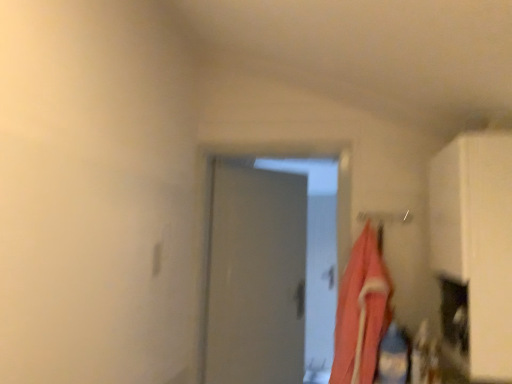
Measure the distance between matte pink fabric at right and camera.

They are 2.06 meters apart.

Identify the location of matte pink fabric at right. This screenshot has width=512, height=384. 361,312.

Measure the distance between point (374, 341) and camera.

Point (374, 341) is 2.08 meters from camera.

Describe the element at coordinates (361, 312) in the screenshot. The image size is (512, 384). I see `matte pink fabric at right` at that location.

What are the coordinates of `white matte cabinet at right` in the screenshot? It's located at (477, 241).

The height and width of the screenshot is (384, 512). What do you see at coordinates (477, 241) in the screenshot?
I see `white matte cabinet at right` at bounding box center [477, 241].

What is the approximate height of white matte cabinet at right?

white matte cabinet at right is 37.44 inches in height.

The height and width of the screenshot is (384, 512). In order to click on matte pink fabric at right in this screenshot , I will do (x=361, y=312).

Based on their positions, is matte pink fabric at right located to the left or right of white matte cabinet at right?

In the image, matte pink fabric at right appears on the left side of white matte cabinet at right.

Which is in front, matte pink fabric at right or white matte cabinet at right?

Positioned in front is white matte cabinet at right.

From the picture: Which is less distant, (386, 287) or (467, 202)?

The point (467, 202) is more forward.

In the scene shown: From the image's perspective, is matte pink fabric at right above or below white matte cabinet at right?

Based on their image positions, matte pink fabric at right is located beneath white matte cabinet at right.

From a real-world perspective, is matte pink fabric at right positioned above or below white matte cabinet at right?

Answer: Clearly, from a real-world perspective, matte pink fabric at right is below white matte cabinet at right.

Considering the relative sizes of matte pink fabric at right and white matte cabinet at right in the image provided, is matte pink fabric at right wider than white matte cabinet at right?

No.

Who is shorter, matte pink fabric at right or white matte cabinet at right?

Standing shorter between the two is matte pink fabric at right.

Who is bigger, matte pink fabric at right or white matte cabinet at right?

white matte cabinet at right.

Is matte pink fabric at right completely or partially outside of white matte cabinet at right?

matte pink fabric at right is positioned outside white matte cabinet at right.

Is matte pink fabric at right placed right next to white matte cabinet at right?

No.

Is matte pink fabric at right aimed at white matte cabinet at right?

No.

How different are the orientations of matte pink fabric at right and white matte cabinet at right in degrees?

The angle between the facing direction of matte pink fabric at right and the facing direction of white matte cabinet at right is 87.1 degrees.

Identify the location of cabinetry above the matte pink fabric at right (from the image's perspective). (477, 241).

Considering the relative positions of white matte cabinet at right and matte pink fabric at right in the image provided, is white matte cabinet at right to the left or to the right of matte pink fabric at right?

From the image, it's evident that white matte cabinet at right is to the right of matte pink fabric at right.

Is the depth of white matte cabinet at right less than that of matte pink fabric at right?

Yes.

Does point (487, 218) appear closer or farther from the camera than point (362, 351)?

Clearly, point (487, 218) is closer to the camera than point (362, 351).

From the image's perspective, is white matte cabinet at right above matte pink fabric at right?

Yes, from the image's perspective, white matte cabinet at right is above matte pink fabric at right.

From a real-world perspective, who is located lower, white matte cabinet at right or matte pink fabric at right?

From a 3D spatial view, matte pink fabric at right is below.

Considering the relative sizes of white matte cabinet at right and matte pink fabric at right in the image provided, is white matte cabinet at right thinner than matte pink fabric at right?

No, white matte cabinet at right is not thinner than matte pink fabric at right.

Can you confirm if white matte cabinet at right is shorter than matte pink fabric at right?

No.

Is white matte cabinet at right bigger or smaller than matte pink fabric at right?

Considering their sizes, white matte cabinet at right takes up more space than matte pink fabric at right.

Is white matte cabinet at right outside of matte pink fabric at right?

Yes.

Is white matte cabinet at right in contact with matte pink fabric at right?

No, white matte cabinet at right is not beside matte pink fabric at right.

Is white matte cabinet at right aimed at matte pink fabric at right?

Yes, white matte cabinet at right is turned towards matte pink fabric at right.

How different are the orientations of white matte cabinet at right and matte pink fabric at right in degrees?

There is a 87.1-degree angle between the facing directions of white matte cabinet at right and matte pink fabric at right.

Measure the distance between white matte cabinet at right and matte pink fabric at right.

A distance of 55.49 centimeters exists between white matte cabinet at right and matte pink fabric at right.

At what (x,y) coordinates should I click in order to perform the action: click on cabinetry above the matte pink fabric at right (from a real-world perspective). Please return your answer as a coordinate pair (x, y). This screenshot has height=384, width=512. Looking at the image, I should click on (477, 241).

The image size is (512, 384). I want to click on cabinetry above the matte pink fabric at right (from a real-world perspective), so pos(477,241).

Find the location of a particular element. Image resolution: width=512 pixels, height=384 pixels. laundry behind the white matte cabinet at right is located at coordinates (361, 312).